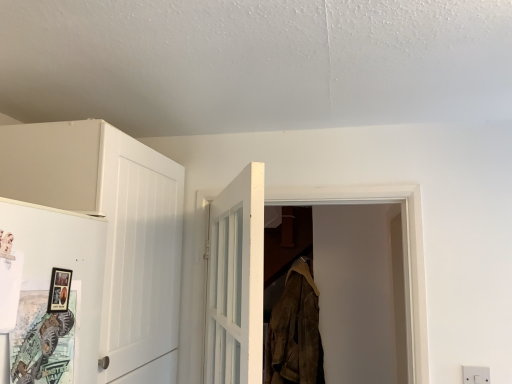
Question: Is white plastic electric outlet at lower right bigger or smaller than matte white door at left, the 2th door when ordered from back to front?

Choices:
 (A) big
 (B) small

Answer: (B)

Question: In the image, is white plastic electric outlet at lower right positioned in front of or behind matte white door at left, acting as the 1th door starting from the front?

Choices:
 (A) behind
 (B) front

Answer: (A)

Question: Estimate the real-world distances between objects in this image. Which object is closer to the white matte cabinet at left?

Choices:
 (A) matte black picture frame at left
 (B) white plastic electric outlet at lower right
 (C) matte white door at left, the first door positioned from the left
 (D) white wooden door at center, the second door when ordered from left to right
 (E) brown suede jacket at center

Answer: (C)

Question: Which of these objects is positioned closest to the matte white door at left, the 2th door when ordered from back to front?

Choices:
 (A) matte black picture frame at left
 (B) white matte cabinet at left
 (C) white plastic electric outlet at lower right
 (D) brown suede jacket at center
 (E) white wooden door at center, the second door when ordered from left to right

Answer: (A)